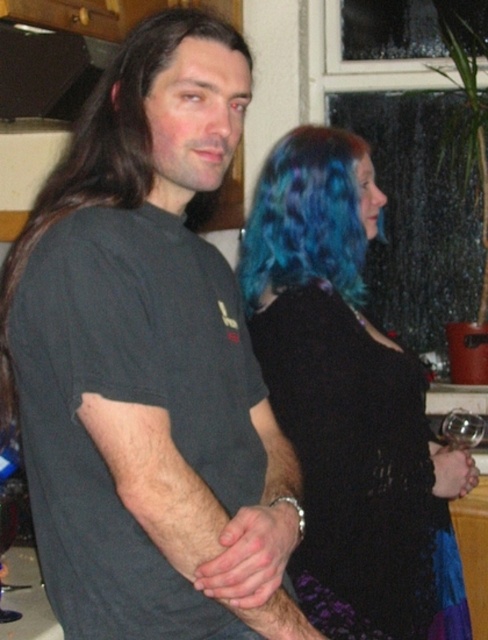
You are a photographer setting up a shoot in this kitchen scene. You need to position a light source to the left of the clear glass wine glass at lower left. Will the light source be to the left or right of the black lace dress at center?

The black lace dress at center is to the right of the clear glass wine glass at lower left. Placing the light source to the left of the wine glass would mean the light source is to the left of the black lace dress at center as well.

You are a photographer trying to capture a candid shot of the two people in the kitchen. The camera you are using has a maximum focus range of 17 inches. Based on the scene, will you be able to focus on both the black matte hair at left and the blue dyed hair at upper right simultaneously?

The distance between the black matte hair at left and the blue dyed hair at upper right is 17.47 inches. Since the camera can only focus within 17 inches, it won not be able to capture both subjects in focus at the same time.

You are a photographer trying to capture a group shot of the black matte hair at left and the blue dyed hair at upper right. Based on their positions, which person should you position closer to the center of the frame to ensure both are equally visible?

The black matte hair at left should be positioned closer to the center of the frame because it might be wider than the blue dyed hair at upper right, ensuring both are equally visible.